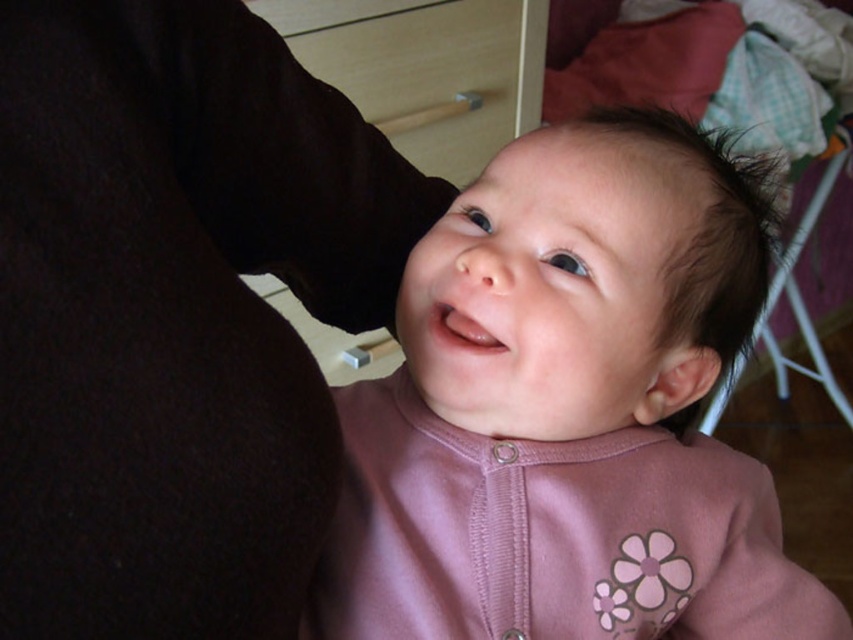
Is pink fabric baby at center smaller than dark brown silky hair at upper right?

Correct, pink fabric baby at center occupies less space than dark brown silky hair at upper right.

Between pink fabric baby at center and dark brown silky hair at upper right, which one is positioned higher?

Positioned higher is dark brown silky hair at upper right.

Is point (560, 278) positioned after point (648, 118)?

No, it is not.

I want to click on pink fabric baby at center, so click(x=569, y=412).